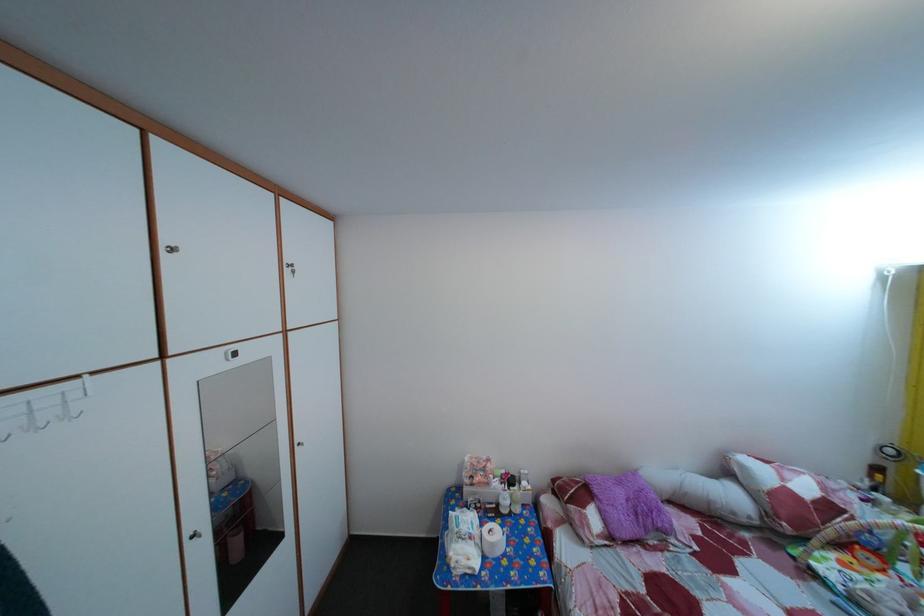
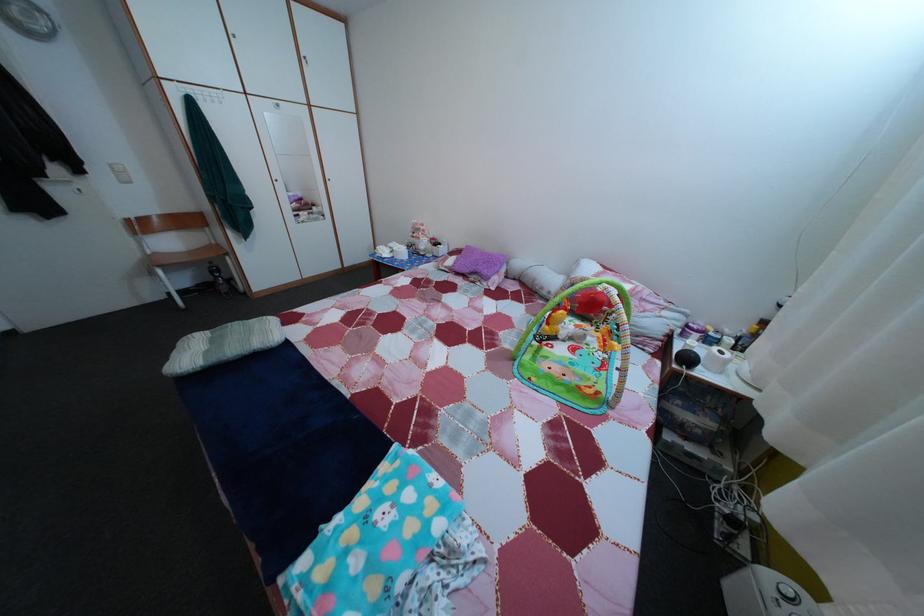
The point at (629, 491) is marked in the first image. Where is the corresponding point in the second image?

(492, 261)